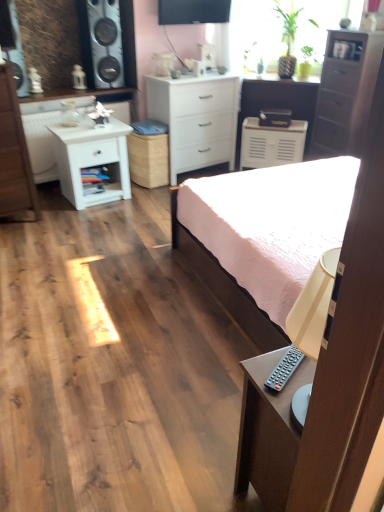
Question: Is white matte chest of drawers at center, which is the second chest of drawers in right-to-left order, smaller than white wood chest of drawers at left, acting as the first chest of drawers starting from the left?

Choices:
 (A) yes
 (B) no

Answer: (B)

Question: From the image's perspective, does white matte chest of drawers at center, which is the second chest of drawers in left-to-right order, appear higher than white wood chest of drawers at left, which appears as the 3th chest of drawers when viewed from the right?

Choices:
 (A) yes
 (B) no

Answer: (A)

Question: Is white matte chest of drawers at center, which is the second chest of drawers in left-to-right order, further to the viewer compared to white wood chest of drawers at left, which appears as the 3th chest of drawers when viewed from the right?

Choices:
 (A) no
 (B) yes

Answer: (B)

Question: From a real-world perspective, is white matte chest of drawers at center, which is the second chest of drawers in right-to-left order, positioned under white wood chest of drawers at left, which appears as the 3th chest of drawers when viewed from the right, based on gravity?

Choices:
 (A) no
 (B) yes

Answer: (B)

Question: Is white matte chest of drawers at center, which is the second chest of drawers in left-to-right order, oriented towards white wood chest of drawers at left, which appears as the 3th chest of drawers when viewed from the right?

Choices:
 (A) no
 (B) yes

Answer: (A)

Question: Looking at their shapes, would you say metallic silver speaker at upper left is wider or thinner than pink fabric bed at center?

Choices:
 (A) thin
 (B) wide

Answer: (A)

Question: In the image, is metallic silver speaker at upper left positioned in front of or behind pink fabric bed at center?

Choices:
 (A) front
 (B) behind

Answer: (B)

Question: Based on their sizes in the image, would you say metallic silver speaker at upper left is bigger or smaller than pink fabric bed at center?

Choices:
 (A) small
 (B) big

Answer: (A)

Question: From a real-world perspective, is metallic silver speaker at upper left above or below pink fabric bed at center?

Choices:
 (A) above
 (B) below

Answer: (A)

Question: Considering their positions, is white wood chest of drawers at left, acting as the first chest of drawers starting from the left, located in front of or behind metallic silver speaker at upper left?

Choices:
 (A) front
 (B) behind

Answer: (A)

Question: From the image's perspective, relative to metallic silver speaker at upper left, is white wood chest of drawers at left, acting as the first chest of drawers starting from the left, above or below?

Choices:
 (A) above
 (B) below

Answer: (B)

Question: Visually, is white wood chest of drawers at left, which appears as the 3th chest of drawers when viewed from the right, positioned to the left or to the right of metallic silver speaker at upper left?

Choices:
 (A) right
 (B) left

Answer: (B)

Question: Is white wood chest of drawers at left, acting as the first chest of drawers starting from the left, situated inside metallic silver speaker at upper left or outside?

Choices:
 (A) inside
 (B) outside

Answer: (B)

Question: Looking at the image, does white glossy cabinet at upper left seem bigger or smaller compared to white matte cabinet at center?

Choices:
 (A) big
 (B) small

Answer: (B)

Question: Considering the positions of white glossy cabinet at upper left and white matte cabinet at center in the image, is white glossy cabinet at upper left taller or shorter than white matte cabinet at center?

Choices:
 (A) short
 (B) tall

Answer: (A)